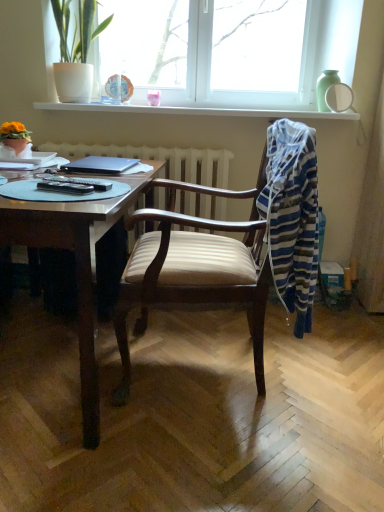
Image resolution: width=384 pixels, height=512 pixels. I want to click on wooden desk at left, so click(77, 266).

What do you see at coordinates (77, 266) in the screenshot? The width and height of the screenshot is (384, 512). I see `wooden desk at left` at bounding box center [77, 266].

You are a GUI agent. You are given a task and a screenshot of the screen. Output one action in this format:
    pyautogui.click(x=<x>, y=<y>)
    Task: Click on the white glossy window sill at upper center
    
    Given the screenshot: What is the action you would take?
    pyautogui.click(x=199, y=111)

At what (x,y) coordinates should I click in order to perform the action: click on striped cotton laundry at right. Please return your answer as a coordinate pair (x, y). The height and width of the screenshot is (512, 384). Looking at the image, I should click on (292, 217).

Image resolution: width=384 pixels, height=512 pixels. Identify the location of wooden chair at center. (232, 250).

Considering the sizes of objects striped cotton laundry at right and white glossy window sill at upper center in the image provided, who is bigger, striped cotton laundry at right or white glossy window sill at upper center?

striped cotton laundry at right.

Between striped cotton laundry at right and white glossy window sill at upper center, which one has more height?

striped cotton laundry at right is taller.

From the image's perspective, is striped cotton laundry at right above or below white glossy window sill at upper center?

striped cotton laundry at right is situated lower than white glossy window sill at upper center in the image.

Consider the image. Would you say striped cotton laundry at right is to the left or to the right of white glossy window sill at upper center in the picture?

striped cotton laundry at right is to the right of white glossy window sill at upper center.

In the scene shown: Is white plastic window at upper center smaller than striped cotton laundry at right?

Incorrect, white plastic window at upper center is not smaller in size than striped cotton laundry at right.

How far apart are white plastic window at upper center and striped cotton laundry at right?

white plastic window at upper center and striped cotton laundry at right are 1.29 meters apart.

How many degrees apart are the facing directions of white plastic window at upper center and striped cotton laundry at right?

The angle between the facing direction of white plastic window at upper center and the facing direction of striped cotton laundry at right is 84.9 degrees.

Does white plastic window at upper center have a lesser height compared to striped cotton laundry at right?

Yes, white plastic window at upper center is shorter than striped cotton laundry at right.

How distant is wooden chair at center from striped cotton laundry at right?

wooden chair at center and striped cotton laundry at right are 4.23 inches apart.

Considering the sizes of objects wooden chair at center and striped cotton laundry at right in the image provided, who is thinner, wooden chair at center or striped cotton laundry at right?

striped cotton laundry at right is thinner.

Considering the sizes of objects wooden chair at center and striped cotton laundry at right in the image provided, who is taller, wooden chair at center or striped cotton laundry at right?

With more height is wooden chair at center.

From a real-world perspective, is wooden chair at center physically located above or below striped cotton laundry at right?

wooden chair at center is situated lower than striped cotton laundry at right in the real world.

Does white glossy window sill at upper center have a lesser height compared to satin black laptop at center?

Incorrect, the height of white glossy window sill at upper center does not fall short of that of satin black laptop at center.

Locate an element on the screen. Image resolution: width=384 pixels, height=512 pixels. window sill above the satin black laptop at center (from the image's perspective) is located at coordinates (199, 111).

From a real-world perspective, is white glossy window sill at upper center on satin black laptop at center?

Yes, from a real-world perspective, white glossy window sill at upper center is on top of satin black laptop at center.

Could you tell me if white glossy window sill at upper center is turned towards satin black laptop at center?

No, white glossy window sill at upper center does not turn towards satin black laptop at center.

Between wooden desk at left and white matte pot at upper left, the second houseplant in the front-to-back sequence, which one has smaller width?

With smaller width is white matte pot at upper left, the second houseplant in the front-to-back sequence.

How far apart are wooden desk at left and white matte pot at upper left, acting as the first houseplant starting from the right?

The distance of wooden desk at left from white matte pot at upper left, acting as the first houseplant starting from the right, is 3.82 feet.

Which of these two, wooden desk at left or white matte pot at upper left, marked as the 1th houseplant in a back-to-front arrangement, stands taller?

Standing taller between the two is wooden desk at left.

Is point (308, 301) positioned in front of point (223, 210)?

Yes, it is in front of point (223, 210).

Is striped cotton laundry at right facing towards white textured radiator at center?

No.

Is striped cotton laundry at right inside or outside of white textured radiator at center?

striped cotton laundry at right is not enclosed by white textured radiator at center.

What's the angular difference between white glossy window sill at upper center and white matte pot at upper left, acting as the first houseplant starting from the right,'s facing directions?

They differ by 7.21 degrees in their facing directions.

Is point (106, 110) more distant than point (60, 74)?

Yes.

Measure the distance from white glossy window sill at upper center to white matte pot at upper left, the second houseplant in the front-to-back sequence.

36.78 centimeters.

Identify the location of window sill below the white matte pot at upper left, the second houseplant in the front-to-back sequence (from a real-world perspective). Image resolution: width=384 pixels, height=512 pixels. (199, 111).

Locate an element on the screen. The height and width of the screenshot is (512, 384). laundry in front of the white glossy window sill at upper center is located at coordinates (292, 217).

The height and width of the screenshot is (512, 384). In the image, there is a white plastic window at upper center. Find the location of `laundry below it (from a real-world perspective)`. laundry below it (from a real-world perspective) is located at coordinates (292, 217).

From the image, which object appears to be nearer to satin black laptop at center, wooden chair at center or white textured radiator at center?

white textured radiator at center is closer to satin black laptop at center.

Based on their spatial positions, is wooden chair at center or striped cotton laundry at right further from white glossy window sill at upper center?

Among the two, striped cotton laundry at right is located further to white glossy window sill at upper center.

Based on their spatial positions, is white plastic window at upper center or white matte pot at upper left, acting as the first houseplant starting from the right, closer to satin black laptop at center?

white matte pot at upper left, acting as the first houseplant starting from the right.

From the image, which object appears to be nearer to white matte pot at upper left, marked as the 1th houseplant in a back-to-front arrangement, striped cotton laundry at right or satin black laptop at center?

satin black laptop at center is positioned closer to the anchor white matte pot at upper left, marked as the 1th houseplant in a back-to-front arrangement.

Estimate the real-world distances between objects in this image. Which object is closer to white matte pot at upper left, placed as the first houseplant when sorted from top to bottom, wooden desk at left or white glossy window sill at upper center?

white glossy window sill at upper center is positioned closer to the anchor white matte pot at upper left, placed as the first houseplant when sorted from top to bottom.

Looking at this image, based on their spatial positions, is satin black laptop at center or white plastic window at upper center further from matte orange flower pot at left, the first houseplant ordered from the bottom?

white plastic window at upper center is positioned further to the anchor matte orange flower pot at left, the first houseplant ordered from the bottom.

Considering their positions, is wooden chair at center positioned further to white glossy window sill at upper center than satin black laptop at center?

wooden chair at center is positioned further to the anchor white glossy window sill at upper center.

Considering their positions, is white textured radiator at center positioned closer to matte orange flower pot at left, which ranks as the 2th houseplant in right-to-left order, than wooden desk at left?

Among the two, white textured radiator at center is located nearer to matte orange flower pot at left, which ranks as the 2th houseplant in right-to-left order.

Identify the location of laptop between white plastic window at upper center and wooden chair at center vertically. (100, 165).

I want to click on radiator between matte orange flower pot at left, the first houseplant ordered from the bottom, and striped cotton laundry at right, so click(162, 159).

Where is `chair positioned between wooden desk at left and white textured radiator at center from near to far`? chair positioned between wooden desk at left and white textured radiator at center from near to far is located at coordinates (232, 250).

Where is `laundry positioned between wooden desk at left and white glossy window sill at upper center from near to far`? Image resolution: width=384 pixels, height=512 pixels. laundry positioned between wooden desk at left and white glossy window sill at upper center from near to far is located at coordinates (292, 217).